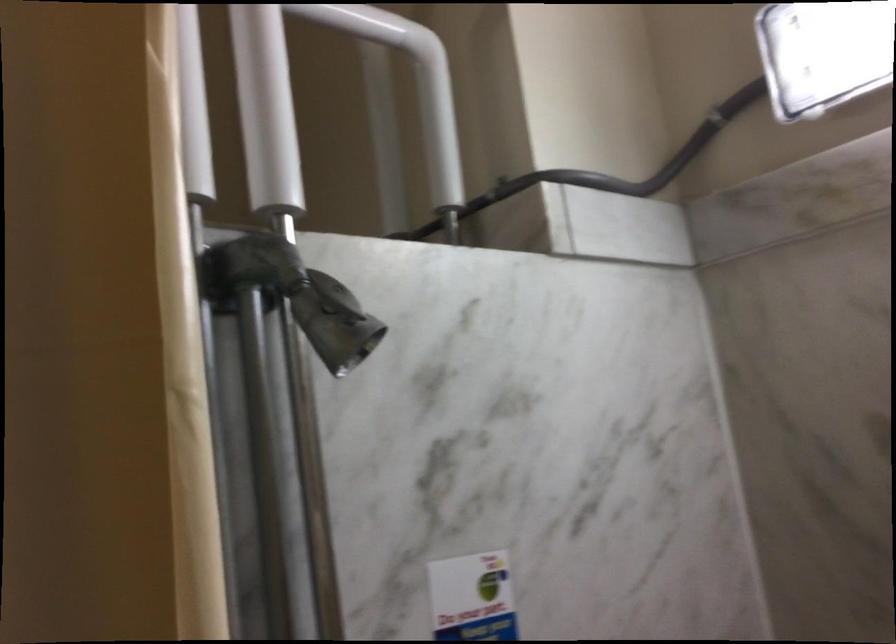
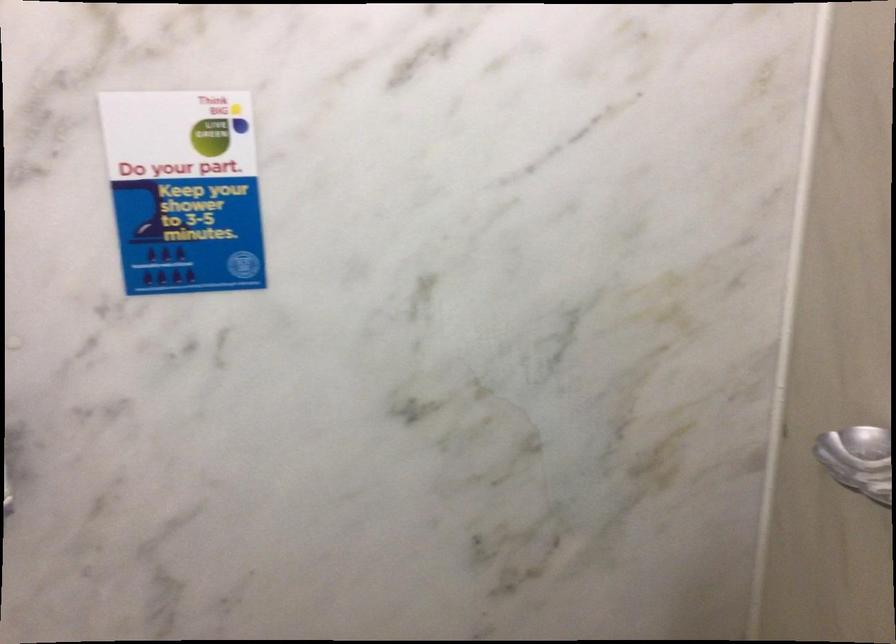
The first image is from the beginning of the video and the second image is from the end. How did the camera likely rotate when shooting the video?

The rotation direction of the camera is right-down.